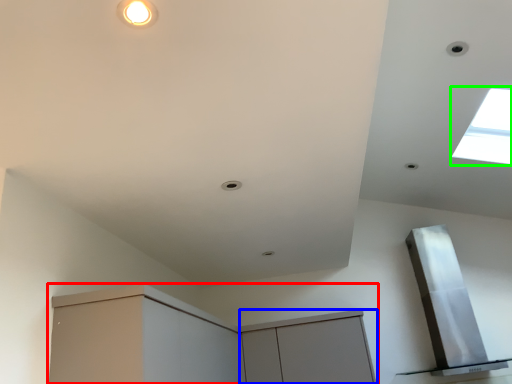
Question: Which object is the farthest from cabinetry (highlighted by a red box)? Choose among these: cabinetry (highlighted by a blue box) or window (highlighted by a green box).

Choices:
 (A) cabinetry
 (B) window

Answer: (B)